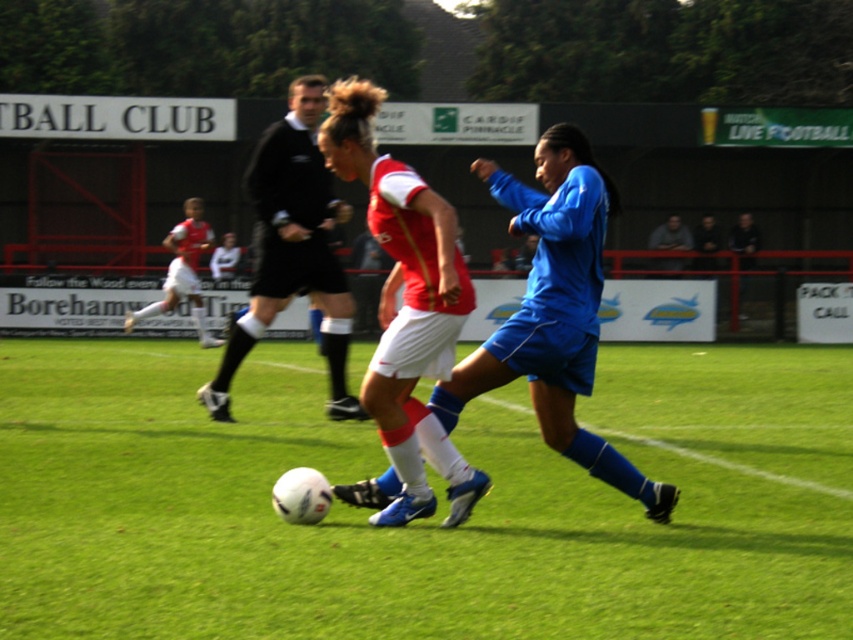
You are a soccer fan watching the match. You notice two players wearing the matte red jersey at center and black jersey at center. Which player is closer to the ground?

The matte red jersey at center is positioned under the black jersey at center, so the player wearing the matte red jersey at center is closer to the ground.

You are a soccer player positioned at the point with coordinates point (238,348). You need to pass the ball to a teammate located at point (666,243). Is the path between these two points clear of any obstacles according to the scene description?

The point (238,348) is in front of point (666,243), so the path between them is clear of any obstacles.